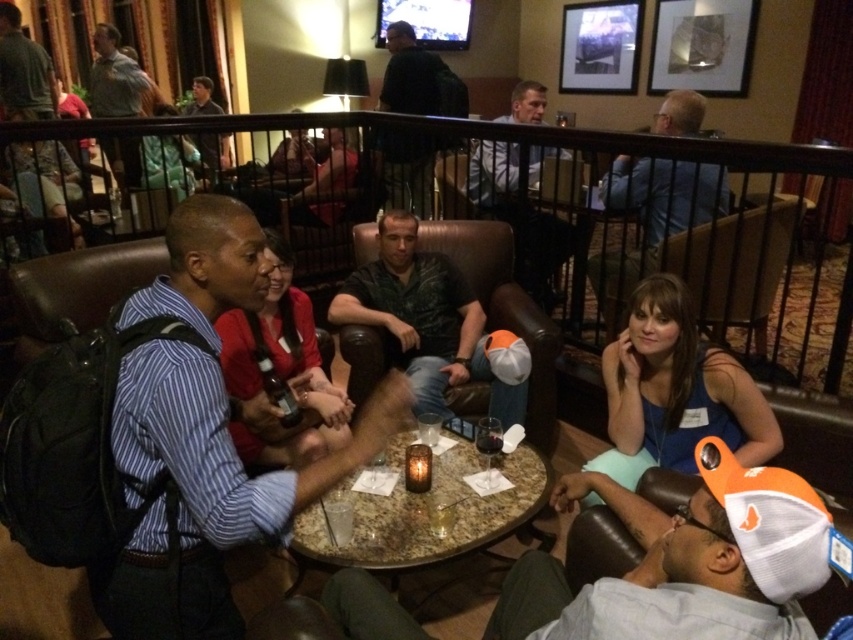
Based on the photo, you are attending a social event and notice two people wearing light blue shirt at upper center and dark green shirt at upper center. Which one is more likely to be in the front row based on their clothing size?

The light blue shirt at upper center has a larger size compared to dark green shirt at upper center, so the person wearing the light blue shirt at upper center is more likely to be in the front row.

You are at a social event and see two people wearing light blue shirt at upper center and dark green shirt at upper center. Which one is closer to you?

The light blue shirt at upper center is closer to you because it is in front of the dark green shirt at upper center.

You are standing in the lounge and want to take a photo of the light blue shirt at upper center. If your camera has a maximum focus range of 10 feet, will you be able to capture a clear photo?

The light blue shirt at upper center is 10.27 feet away from the viewer. Since the camera can only focus up to 10 feet, it will be slightly out of range, resulting in a blurry photo.